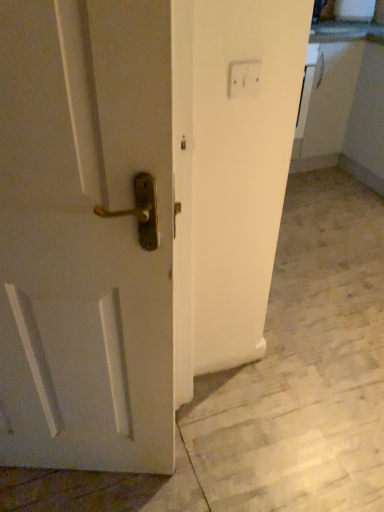
The height and width of the screenshot is (512, 384). Find the location of `white plastic switch at upper center`. white plastic switch at upper center is located at coordinates (244, 78).

Describe the element at coordinates (244, 78) in the screenshot. I see `white plastic switch at upper center` at that location.

I want to click on white plastic switch at upper center, so click(244, 78).